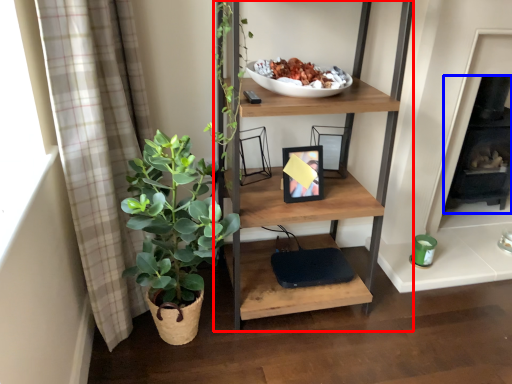
Question: Which object is closer to the camera taking this photo, shelf (highlighted by a red box) or fireplace (highlighted by a blue box)?

Choices:
 (A) shelf
 (B) fireplace

Answer: (A)